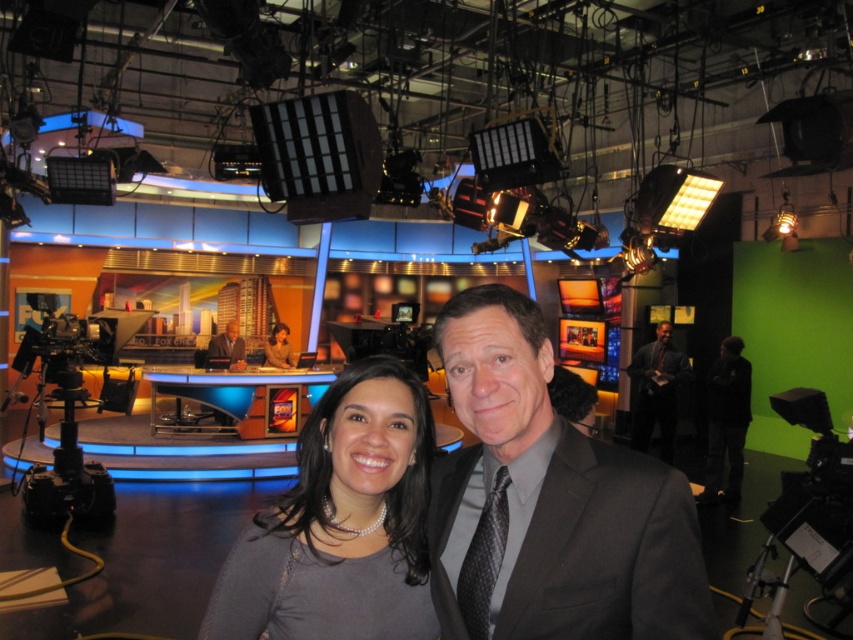
Question: Can you confirm if black fabric at right is positioned to the left of matte black suit at center?

Choices:
 (A) yes
 (B) no

Answer: (B)

Question: Does dark gray suit at right appear under matte black suit at center?

Choices:
 (A) yes
 (B) no

Answer: (A)

Question: Based on their relative distances, which object is nearer to the dark gray suit at center?

Choices:
 (A) gray pearl necklace at center
 (B) black fabric at right
 (C) dark gray suit at right
 (D) smooth gray suit at center

Answer: (A)

Question: Is the position of dark gray suit at center less distant than that of dark gray suit at right?

Choices:
 (A) no
 (B) yes

Answer: (B)

Question: Estimate the real-world distances between objects in this image. Which object is farther from the dark gray suit at right?

Choices:
 (A) matte black suit at center
 (B) smooth gray suit at center
 (C) gray pearl necklace at center
 (D) black fabric at right

Answer: (C)

Question: Which of the following is the farthest from the observer?

Choices:
 (A) dark gray suit at center
 (B) smooth gray suit at center
 (C) black fabric at right
 (D) dark gray suit at right

Answer: (B)